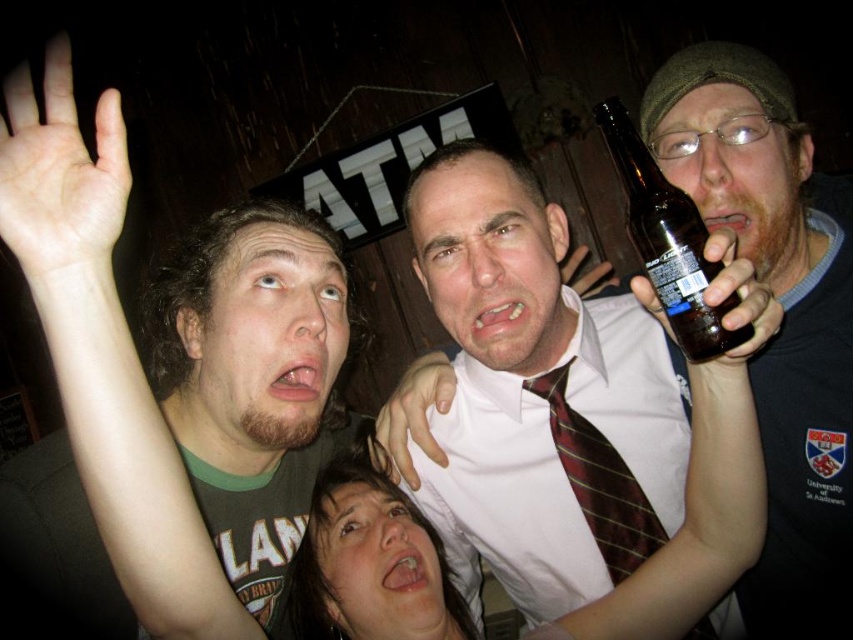
You are a bartender preparing to place two bottles on a shelf. The shelf has a height limit of 15 cm. The brown glass bottle at right is 12 cm tall and the matte black bottle at upper right is 18 cm tall. Can both bottles fit vertically on the shelf without exceeding the height limit?

The brown glass bottle at right is 12 cm tall and the matte black bottle at upper right is 18 cm tall. The shelf has a height limit of 15 cm. The brown glass bottle at right can fit vertically, but the matte black bottle at upper right is taller than the limit. Therefore, only the brown glass bottle at right can be placed on the shelf without exceeding the height limit.

You are a bartender preparing a drink and need to grab the brown glass bottle at right and the matte black bottle at upper right. Which one do you need to reach down to get?

The brown glass bottle at right is below the matte black bottle at upper right, so you need to reach down to get the brown glass bottle at right.

You are a photographer trying to capture the interaction between the two hands in the image. Which hand, the skinny white hand at upper left or the smooth skin hand at center, is closer to your camera lens?

The skinny white hand at upper left is closer to the camera lens because it is positioned in front of the smooth skin hand at center.